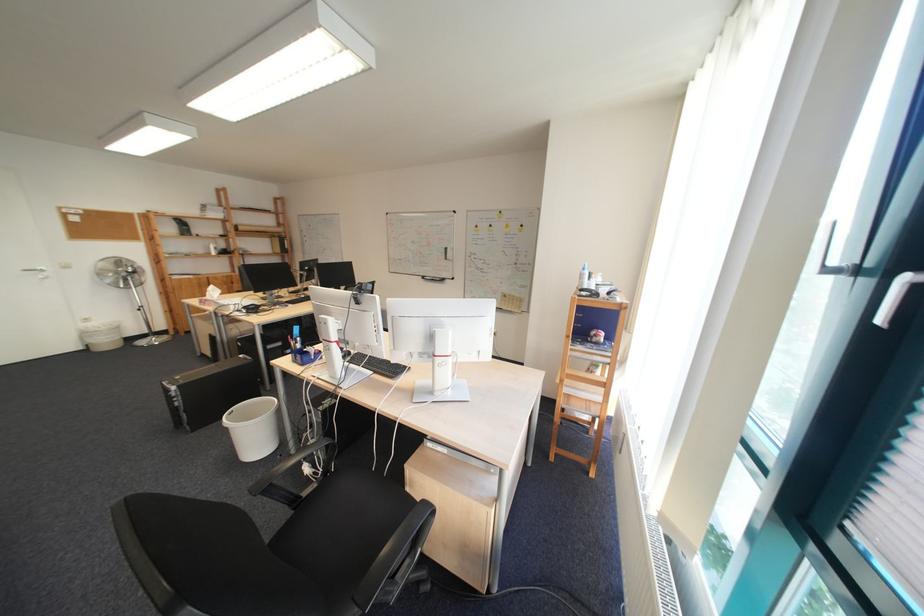
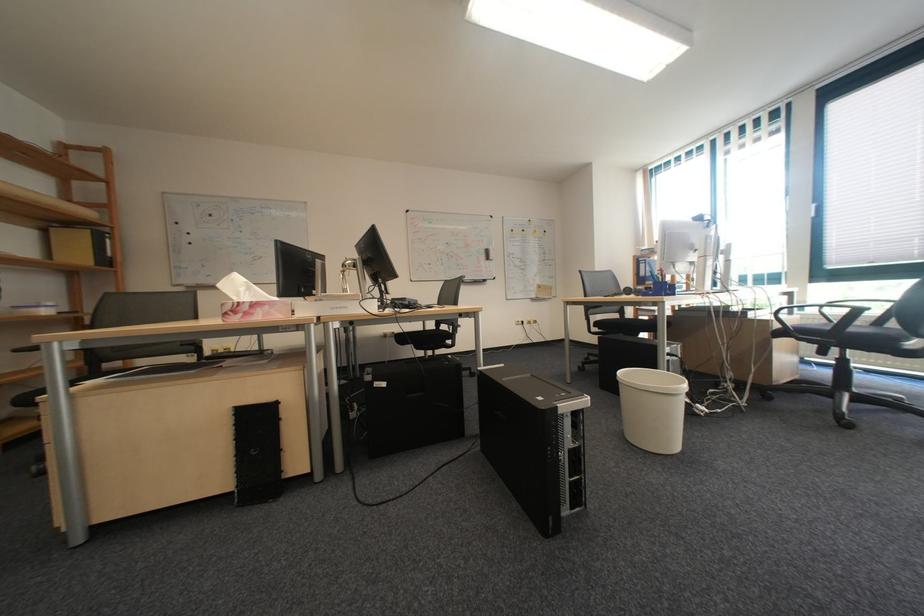
Find the pixel in the second image that matches the point at 407,233 in the first image.

(431, 233)